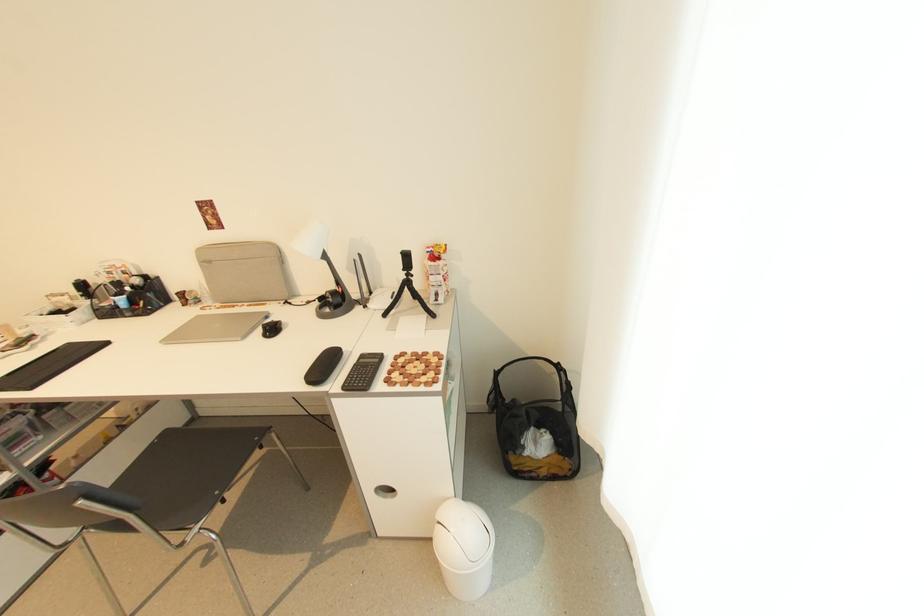
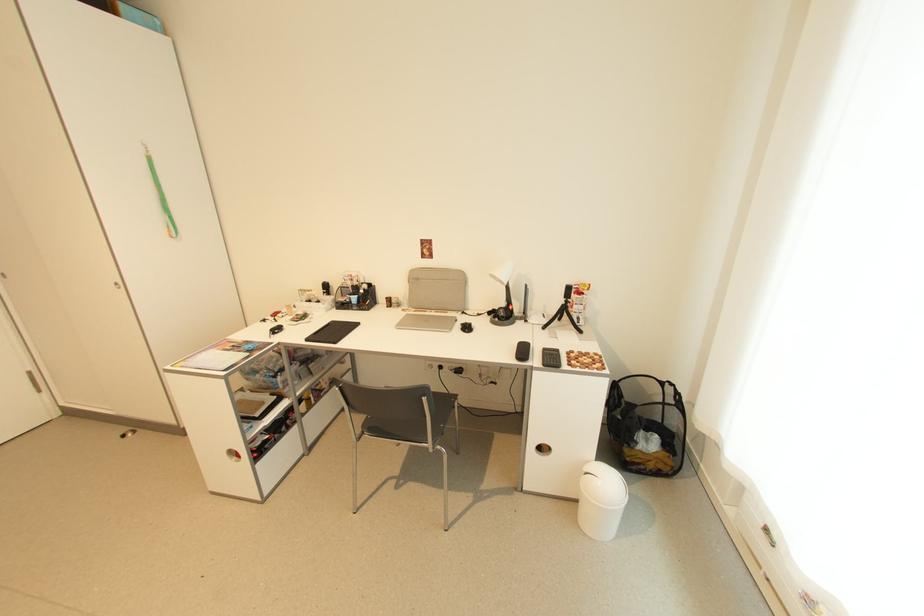
The point at (88, 530) is marked in the first image. Where is the corresponding point in the second image?

(368, 434)